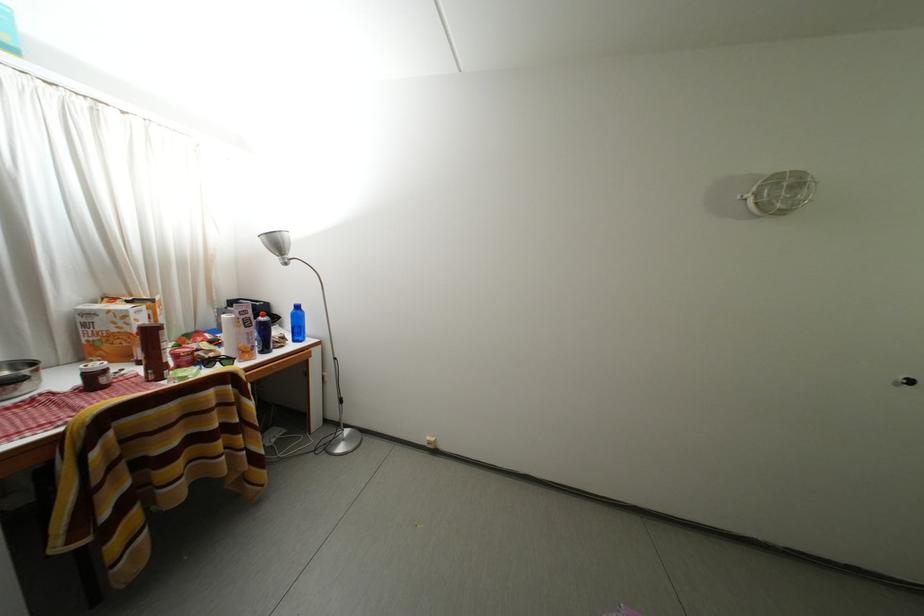
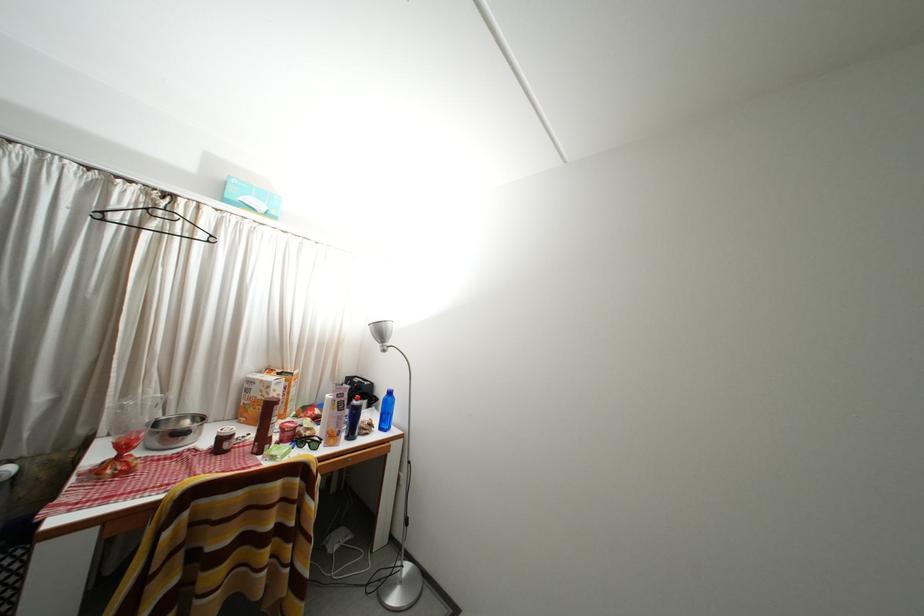
Find the pixel in the second image that matches (220,360) in the first image.

(315, 439)